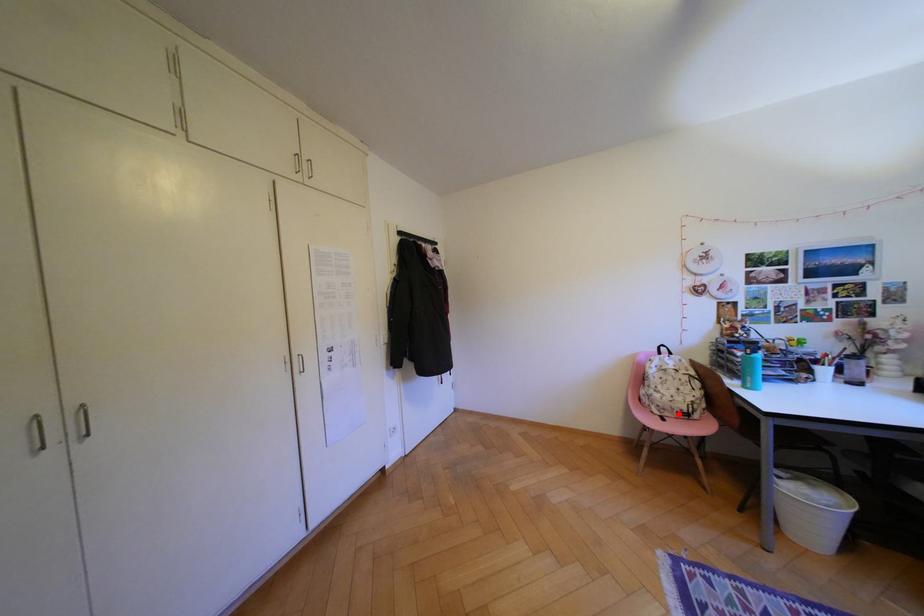
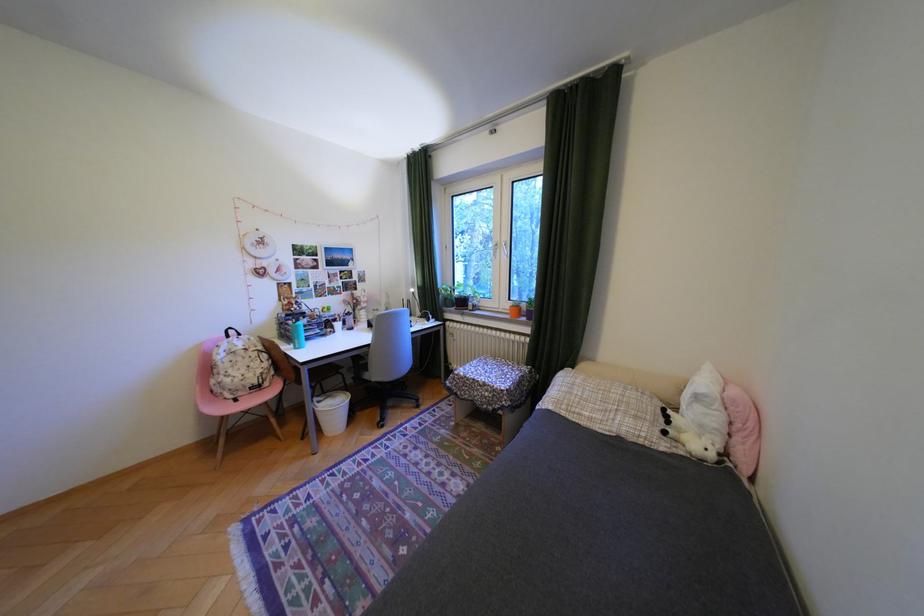
Find the pixel in the second image that matches the highlighted location in the first image.

(251, 394)